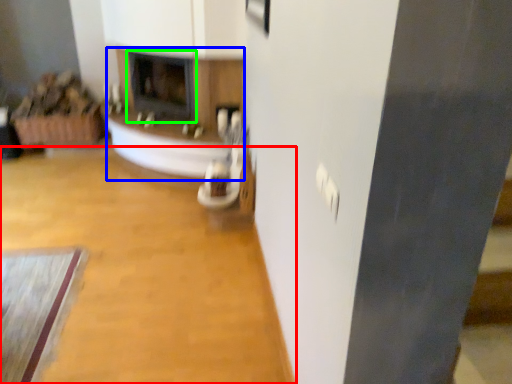
Question: Which object is positioned closest to plain (highlighted by a red box)? Select from fireplace (highlighted by a blue box) and fireplace (highlighted by a green box).

Choices:
 (A) fireplace
 (B) fireplace

Answer: (A)